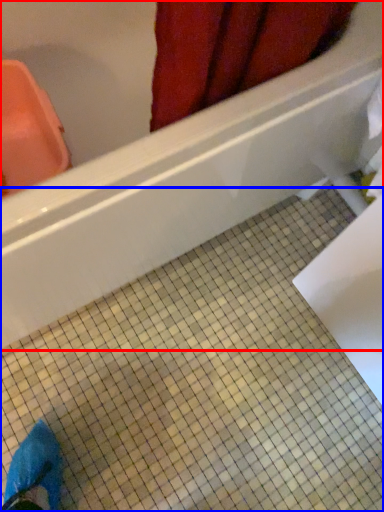
Question: Which of the following is the farthest to the observer, bathtub (highlighted by a red box) or ceramic tile (highlighted by a blue box)?

Choices:
 (A) bathtub
 (B) ceramic tile

Answer: (B)